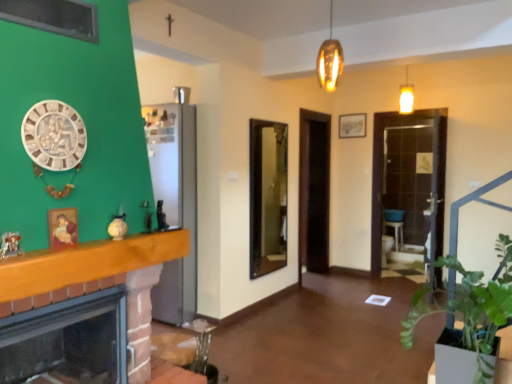
Question: Can you see brick fireplace at left touching wooden mantel at left?

Choices:
 (A) yes
 (B) no

Answer: (B)

Question: From a real-world perspective, does brick fireplace at left sit lower than wooden mantel at left?

Choices:
 (A) no
 (B) yes

Answer: (B)

Question: Is brick fireplace at left aimed at wooden mantel at left?

Choices:
 (A) yes
 (B) no

Answer: (B)

Question: From the image's perspective, is brick fireplace at left on wooden mantel at left?

Choices:
 (A) no
 (B) yes

Answer: (A)

Question: Is brick fireplace at left smaller than wooden mantel at left?

Choices:
 (A) yes
 (B) no

Answer: (B)

Question: Is the depth of brick fireplace at left less than that of wooden mantel at left?

Choices:
 (A) yes
 (B) no

Answer: (B)

Question: Is the depth of wooden mantel at left greater than that of brick fireplace at left?

Choices:
 (A) no
 (B) yes

Answer: (A)

Question: Can you confirm if wooden mantel at left is positioned to the right of brick fireplace at left?

Choices:
 (A) no
 (B) yes

Answer: (B)

Question: Can you confirm if wooden mantel at left is shorter than brick fireplace at left?

Choices:
 (A) no
 (B) yes

Answer: (B)

Question: Could you tell me if wooden mantel at left is facing brick fireplace at left?

Choices:
 (A) no
 (B) yes

Answer: (A)

Question: Is brick fireplace at left located within wooden mantel at left?

Choices:
 (A) no
 (B) yes

Answer: (A)

Question: Is wooden mantel at left positioned before brick fireplace at left?

Choices:
 (A) no
 (B) yes

Answer: (B)

Question: Does brick fireplace at left have a greater height compared to green leafy plant at lower right?

Choices:
 (A) yes
 (B) no

Answer: (B)